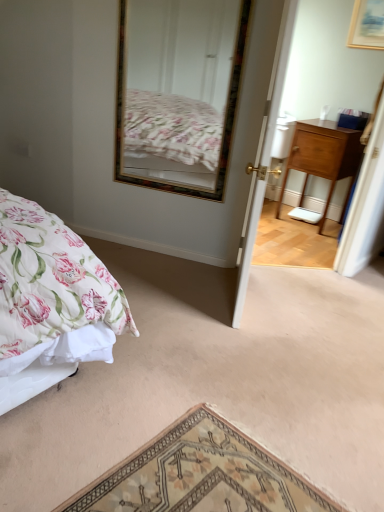
Question: From a real-world perspective, is wooden-framed mirror at upper center physically located above or below wooden picture frame at upper right?

Choices:
 (A) above
 (B) below

Answer: (B)

Question: Is point (220, 99) positioned closer to the camera than point (357, 29)?

Choices:
 (A) farther
 (B) closer

Answer: (B)

Question: Estimate the real-world distances between objects in this image. Which object is closer to the wooden nightstand at right?

Choices:
 (A) wooden-framed mirror at upper center
 (B) wooden picture frame at upper right
 (C) white wooden door at center

Answer: (B)

Question: Estimate the real-world distances between objects in this image. Which object is farther from the wooden nightstand at right?

Choices:
 (A) wooden-framed mirror at upper center
 (B) wooden picture frame at upper right
 (C) white wooden door at center

Answer: (C)